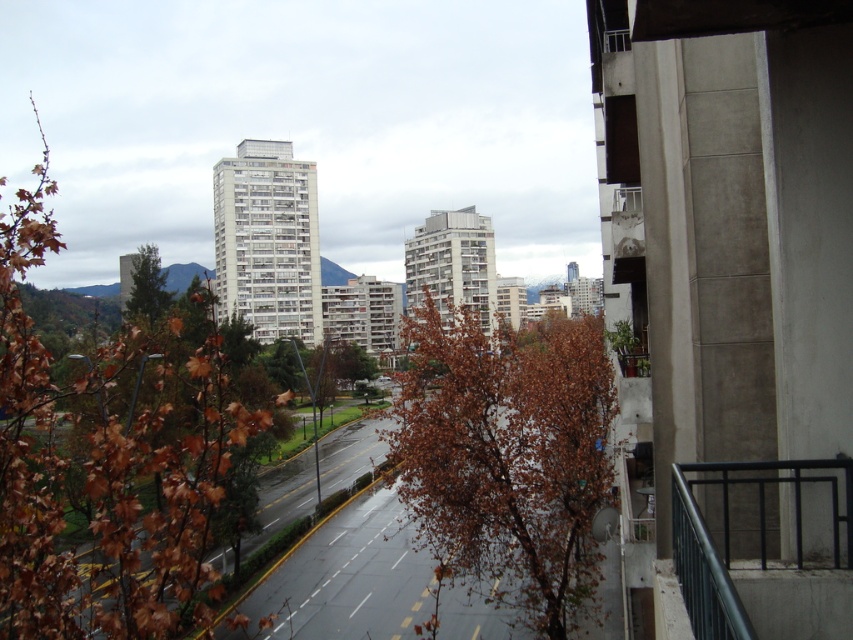
Does brown leafy tree at upper left come in front of green leafy tree at left?

That is True.

Does brown leafy tree at upper left have a lesser width compared to green leafy tree at left?

In fact, brown leafy tree at upper left might be wider than green leafy tree at left.

Is point (50, 547) positioned before point (142, 262)?

Yes, it is in front of point (142, 262).

Identify the location of brown leafy tree at upper left. The width and height of the screenshot is (853, 640). (108, 461).

Can you confirm if brown leafy tree at center is thinner than green leafy tree at left?

Correct, brown leafy tree at center's width is less than green leafy tree at left's.

Between point (523, 336) and point (151, 257), which one is positioned in front?

Point (523, 336) is in front.

Locate an element on the screen. This screenshot has width=853, height=640. brown leafy tree at center is located at coordinates (508, 458).

Is brown leafy tree at upper left bigger than brown leafy tree at center?

Yes.

Does brown leafy tree at upper left appear over brown leafy tree at center?

Correct, brown leafy tree at upper left is located above brown leafy tree at center.

Looking at this image, who is more distant from viewer, (21, 451) or (587, 448)?

The point (587, 448) is behind.

You are a GUI agent. You are given a task and a screenshot of the screen. Output one action in this format:
    pyautogui.click(x=<x>, y=<y>)
    Task: Click on the brown leafy tree at upper left
    
    Given the screenshot: What is the action you would take?
    pyautogui.click(x=108, y=461)